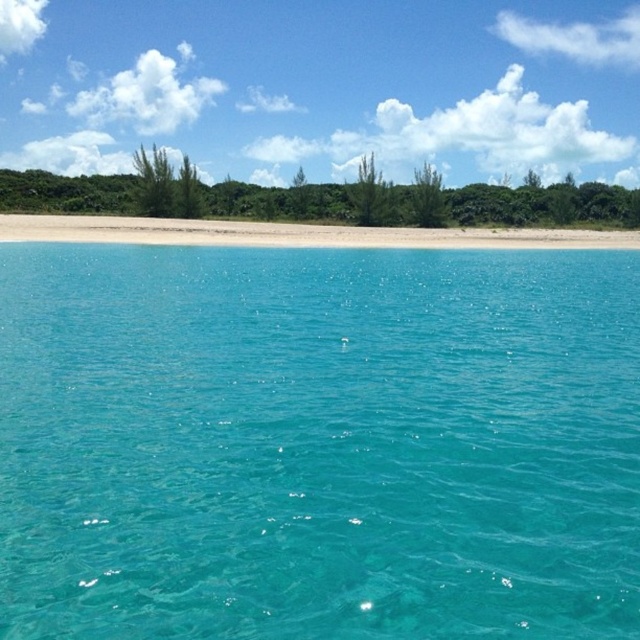
You are standing on the white sand beach at center and want to wade into the turquoise glossy water at center. How does the height of the water compare to the beach when you step in?

The turquoise glossy water at center is much taller than the white sand beach at center, so when you step in, the water will come up higher on your body compared to the beach.

You are planning to build a small sandcastle on the beach. To ensure it stays intact, you need to know which area is wider between the turquoise glossy water at center and the white sand beach at center. Which one is wider?

The white sand beach at center is wider than the turquoise glossy water at center, so building the sandcastle on the beach would be more stable as it has a wider area.